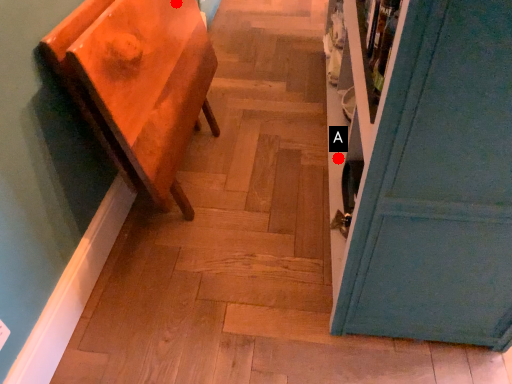
Question: Two points are circled on the image, labeled by A and B beside each circle. Among these points, which one is nearest to the camera?

Choices:
 (A) A is closer
 (B) B is closer

Answer: (B)